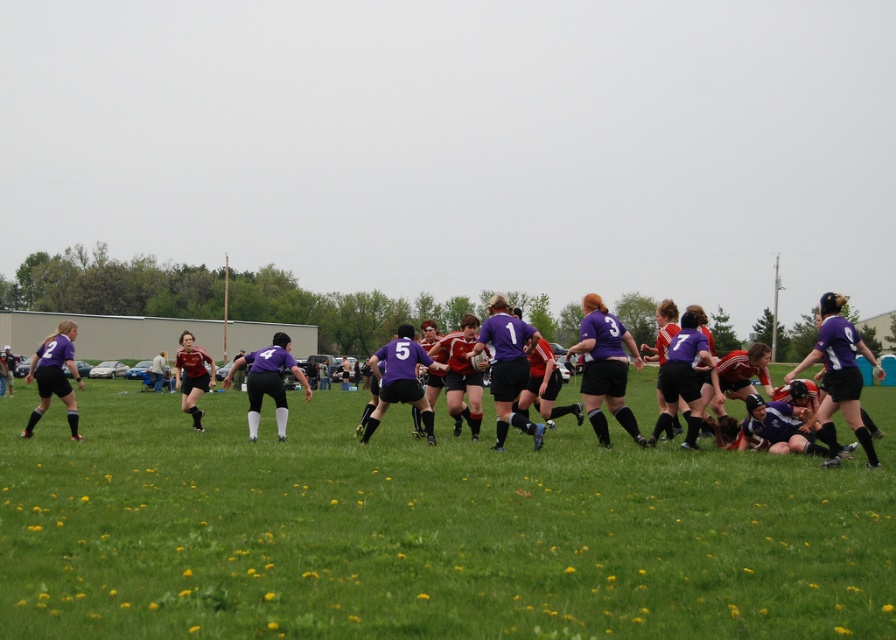
Between green grass at center and purple matte rugby team at center, which one appears on the left side from the viewer's perspective?

purple matte rugby team at center

Which is in front, point (672, 529) or point (685, 580)?

Point (685, 580) is more forward.

At what (x,y) coordinates should I click in order to perform the action: click on green grass at center. Please return your answer as a coordinate pair (x, y). This screenshot has width=896, height=640. Looking at the image, I should click on (425, 529).